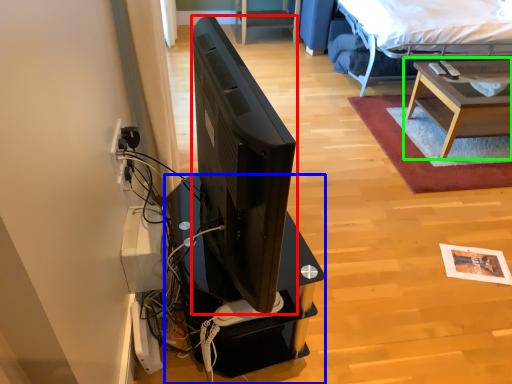
Question: Which is nearer to the television (highlighted by a red box)? desk (highlighted by a blue box) or table (highlighted by a green box).

Choices:
 (A) desk
 (B) table

Answer: (A)